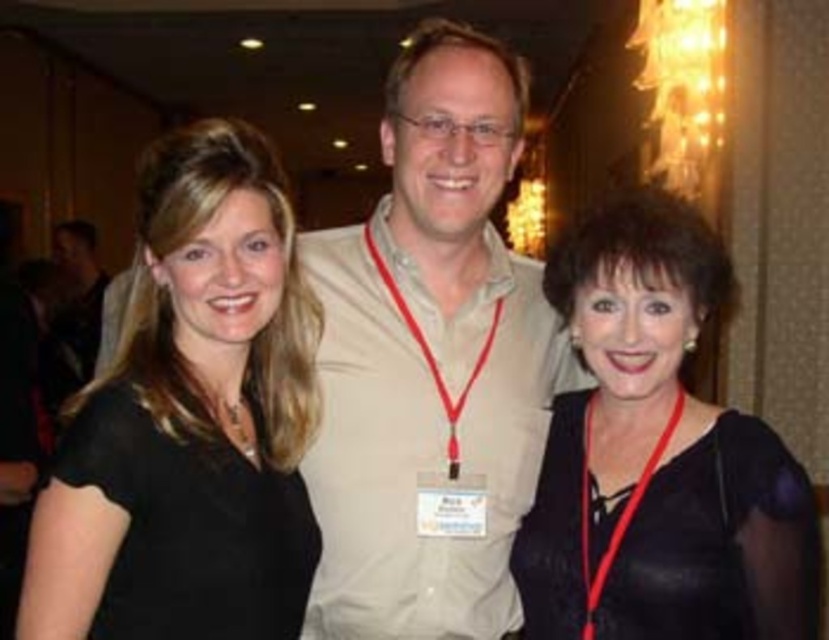
You are a photographer setting up for a group photo. You need to ensure that the beige cotton shirt at center and the black leather dress at right are both visible in the frame. Considering their heights, which one might you need to adjust the camera angle for to ensure proper framing?

The beige cotton shirt at center is much taller than the black leather dress at right. To ensure both are visible, you might need to lower the camera angle slightly to capture the full height of the beige cotton shirt at center without cropping it, while still keeping the black leather dress at right in frame.

You are a photographer at a conference and need to adjust the lighting so that both the beige cotton shirt at center and the black leather dress at right are evenly illuminated. Given their positions, which object should you focus the light on to ensure proper exposure?

The beige cotton shirt at center is located above the black leather dress at right. Since the beige cotton shirt is higher up, focusing the light on it would help ensure both receive adequate illumination without overexposing the lower area.